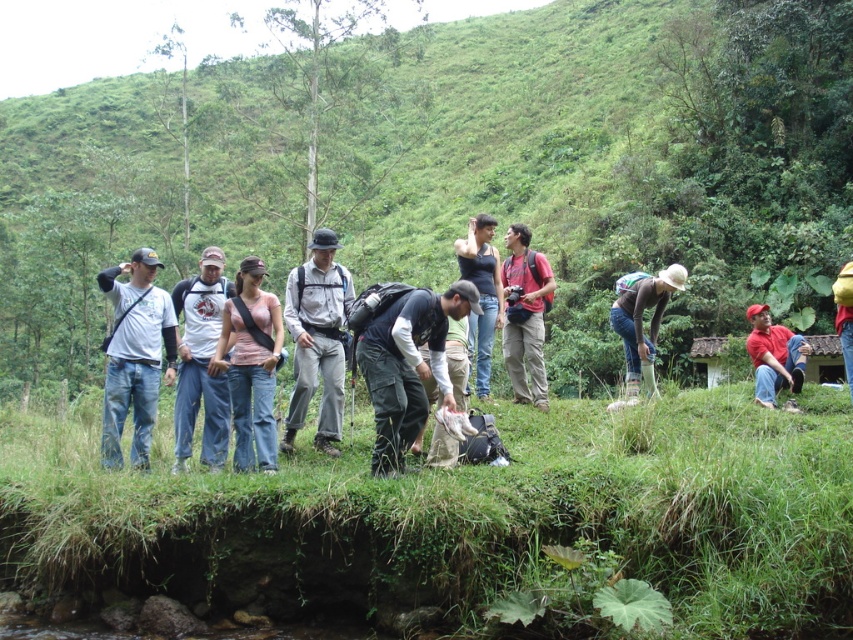
You are a photographer standing at the light brown fabric shirt at center and want to take a photo of the red matte shirt at lower right. Can you fit both subjects into your camera frame without moving? The camera has a maximum range of 5 meters.

The distance between the light brown fabric shirt at center and the red matte shirt at lower right is 5.78 meters, which exceeds the camera frame range of 5 meters. Therefore, you cannot fit both subjects into the camera frame without moving.